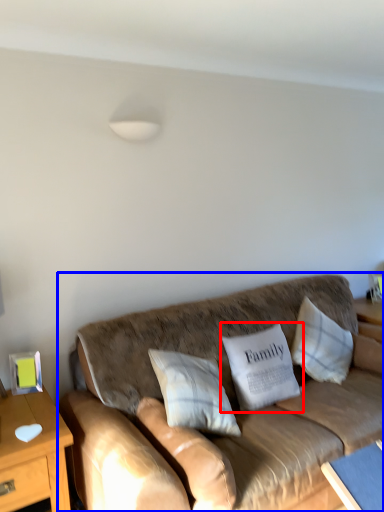
Question: Which point is closer to the camera, pillow (highlighted by a red box) or studio couch (highlighted by a blue box)?

Choices:
 (A) pillow
 (B) studio couch

Answer: (B)